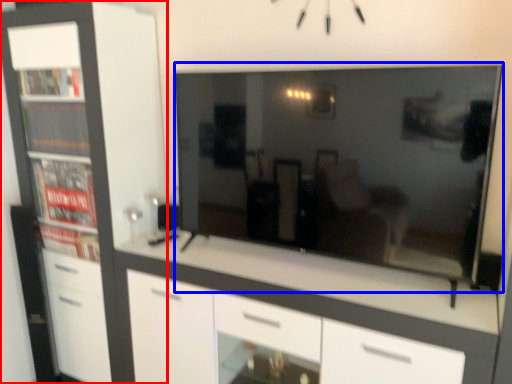
Question: Which point is further to the camera, cabinetry (highlighted by a red box) or television (highlighted by a blue box)?

Choices:
 (A) cabinetry
 (B) television

Answer: (A)